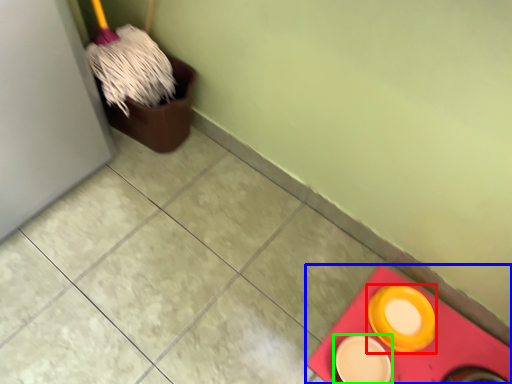
Question: Considering the real-world distances, which object is farthest from tableware (highlighted by a red box)? tile (highlighted by a blue box) or tableware (highlighted by a green box)?

Choices:
 (A) tile
 (B) tableware

Answer: (B)